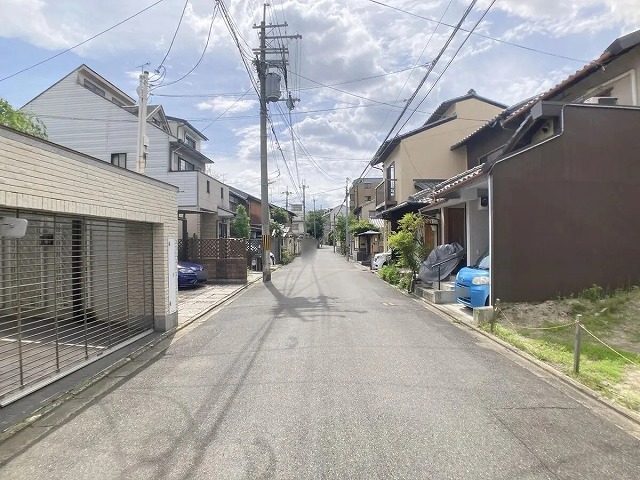
The width and height of the screenshot is (640, 480). What are the coordinates of `wood lattice left side` in the screenshot? It's located at (253, 246), (223, 252).